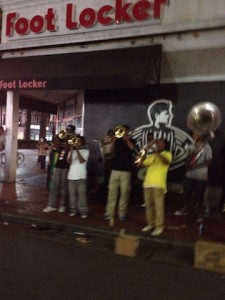
Locate an element on the screen. Image resolution: width=225 pixels, height=300 pixels. red tile floor is located at coordinates (35, 194).